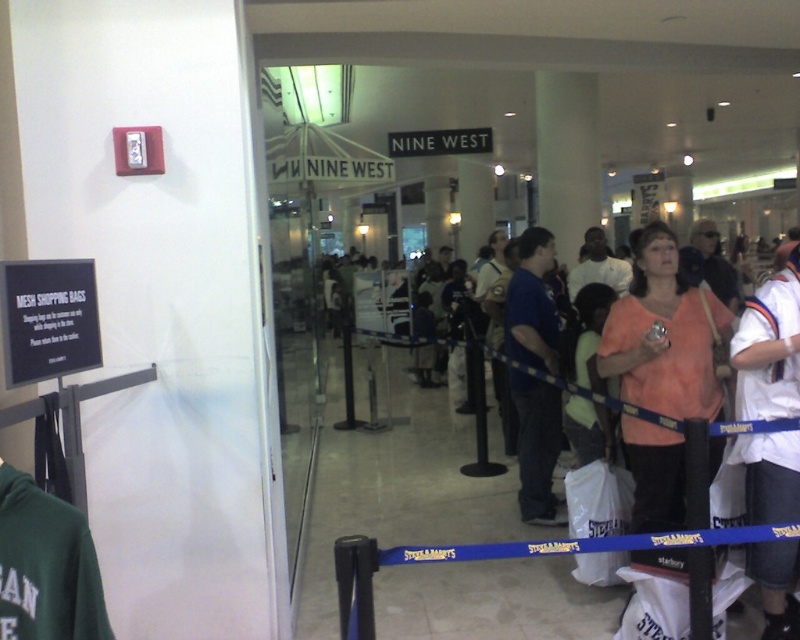
Is point (754, 452) less distant than point (512, 305)?

Yes, point (754, 452) is in front of point (512, 305).

Locate an element on the screen. white cotton shirt at center is located at coordinates (770, 346).

Measure the distance between white cotton shirt at center and camera.

white cotton shirt at center is 2.54 meters from camera.

Find the location of a particular element. The width and height of the screenshot is (800, 640). white cotton shirt at center is located at coordinates coord(770,346).